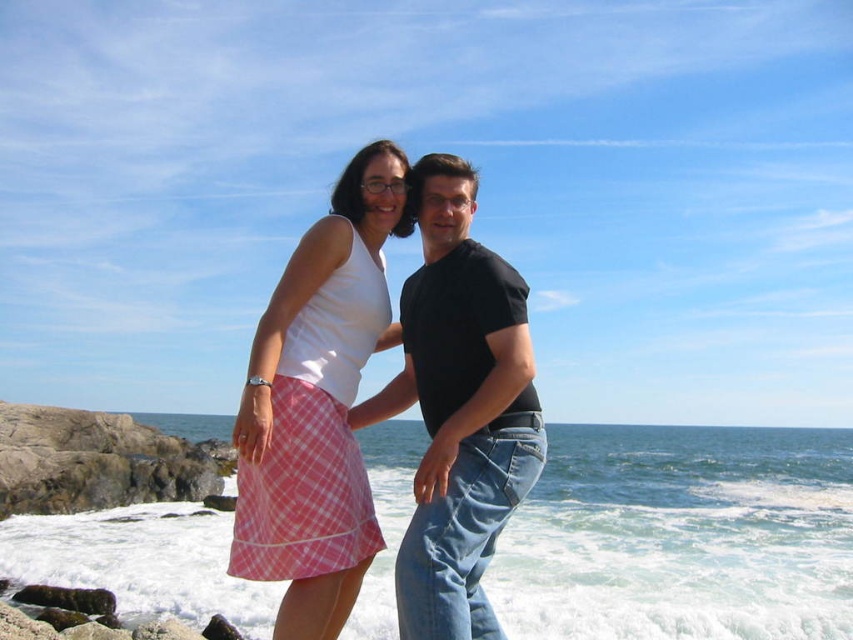
You are a photographer trying to capture the perfect shot of the scene. The pink checkered skirt at center is your main focus. Based on its 2D coordinates, where should you position your camera to ensure it is centered in your viewfinder?

To center the pink checkered skirt at center in your viewfinder, position your camera so that it aligns with the coordinates provided, ensuring the skirt is at the center point of your frame.